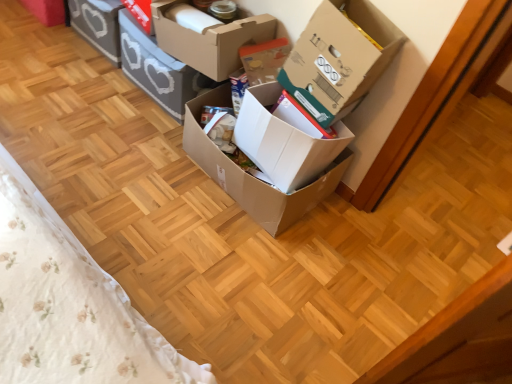
Where is `vacant space positioned to the left of cardboard box at center, the second box in the left-to-right sequence`? This screenshot has height=384, width=512. vacant space positioned to the left of cardboard box at center, the second box in the left-to-right sequence is located at coordinates (86, 86).